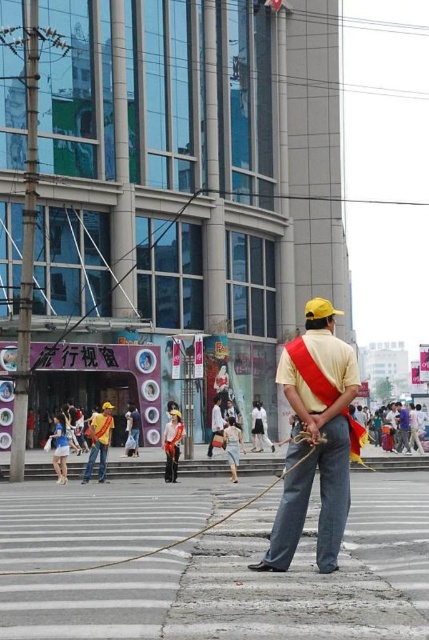
Question: Which point is farther to the camera?

Choices:
 (A) brown rough rope at center
 (B) yellow matte/solid hat at center

Answer: (B)

Question: Can you confirm if yellow matte/solid hat at center is wider than brown rough rope at center?

Choices:
 (A) no
 (B) yes

Answer: (A)

Question: Is yellow matte/solid hat at center above brown rough rope at center?

Choices:
 (A) no
 (B) yes

Answer: (B)

Question: Which point is closer to the camera?

Choices:
 (A) brown rough rope at center
 (B) yellow matte/solid hat at center

Answer: (A)

Question: Does yellow matte/solid hat at center appear on the right side of brown rough rope at center?

Choices:
 (A) no
 (B) yes

Answer: (B)

Question: Which object is farther from the camera taking this photo?

Choices:
 (A) brown rough rope at center
 (B) yellow matte/solid hat at center

Answer: (B)